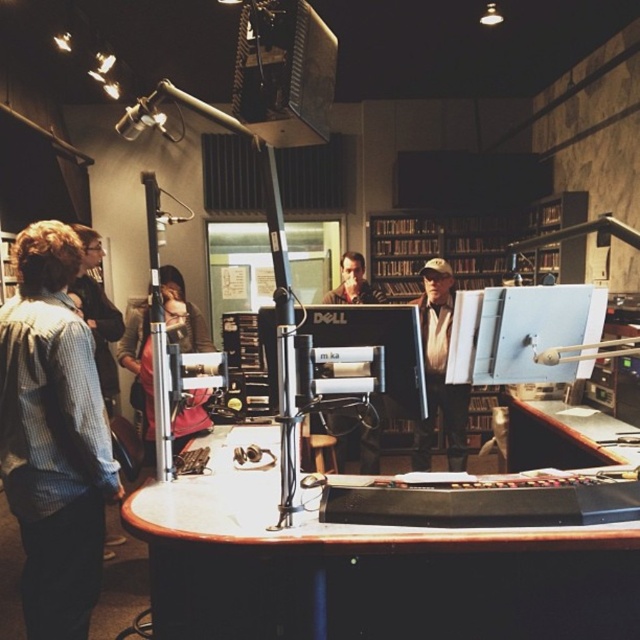
You are a guest speaker preparing to enter the recording studio. You see the wooden bookshelf at center and the khaki cotton cap at center. Which object is positioned higher in the studio?

The wooden bookshelf at center is positioned higher than the khaki cotton cap at center.

You are a guest speaker preparing to give a talk in the studio. You need to place your notes on a surface that can hold them securely. The brown wood table at lower right and the matte black monitor at center are both available. Which surface should you choose based on size?

The brown wood table at lower right has a larger size compared to the matte black monitor at center, so you should place your notes on the brown wood table at lower right as it provides more space for secure placement.